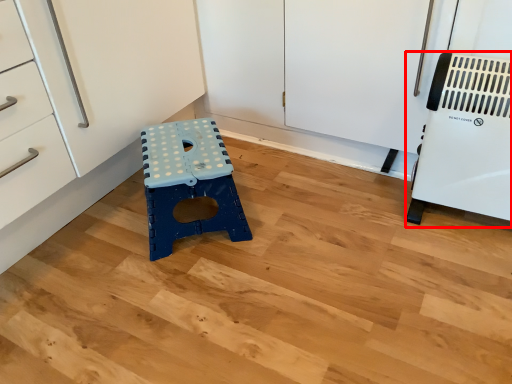
Question: From the image's perspective, where is appliance (annotated by the red box) located in relation to furniture in the image?

Choices:
 (A) above
 (B) below

Answer: (A)